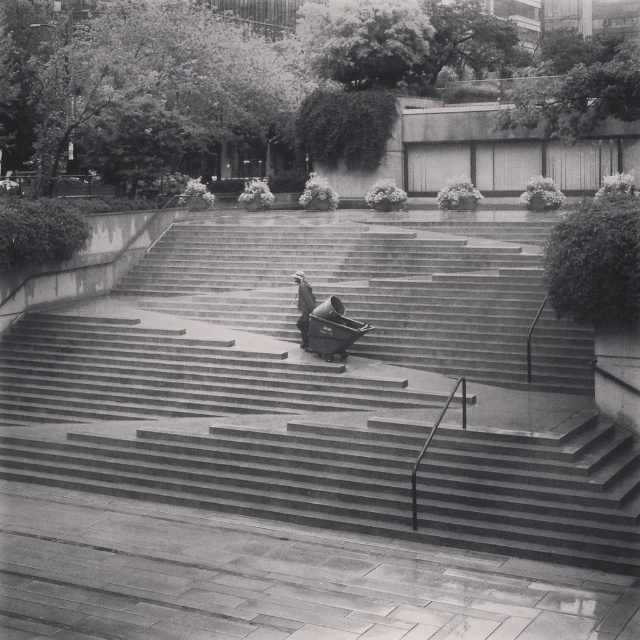
Question: Considering the relative positions of concrete stairs at center and dark gray fabric coat at center in the image provided, where is concrete stairs at center located with respect to dark gray fabric coat at center?

Choices:
 (A) left
 (B) right

Answer: (A)

Question: From the image, what is the correct spatial relationship of concrete stairs at center in relation to dark gray fabric coat at center?

Choices:
 (A) left
 (B) right

Answer: (A)

Question: Which object is farther from the camera taking this photo?

Choices:
 (A) concrete stairs at center
 (B) dark gray fabric coat at center

Answer: (B)

Question: Which object is closer to the camera taking this photo?

Choices:
 (A) concrete stairs at center
 (B) dark gray fabric coat at center

Answer: (A)

Question: Does concrete stairs at center have a larger size compared to dark gray fabric coat at center?

Choices:
 (A) yes
 (B) no

Answer: (A)